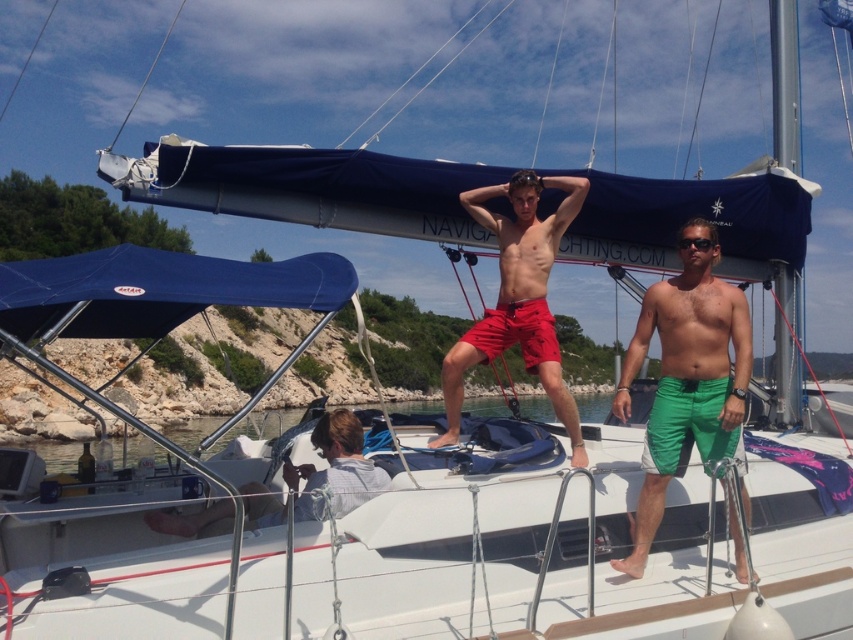
Is point (457, 401) positioned in front of point (200, 518)?

That is False.

Who is more forward, (556,212) or (354,493)?

Point (354,493)

At what (x,y) coordinates should I click in order to perform the action: click on matte red shorts at center. Please return your answer as a coordinate pair (x, y). The width and height of the screenshot is (853, 640). Looking at the image, I should click on (518, 298).

Who is taller, green fabric shorts at center or white cotton shirt at lower left?

green fabric shorts at center is taller.

The image size is (853, 640). Describe the element at coordinates (686, 378) in the screenshot. I see `green fabric shorts at center` at that location.

At what (x,y) coordinates should I click in order to perform the action: click on green fabric shorts at center. Please return your answer as a coordinate pair (x, y). This screenshot has width=853, height=640. Looking at the image, I should click on (686, 378).

Based on the photo, does matte red shorts at center have a lesser width compared to black plastic sunglasses at upper center?

Incorrect, matte red shorts at center's width is not less than black plastic sunglasses at upper center's.

Between point (549, 310) and point (694, 244), which one is positioned in front?

Point (694, 244) is more forward.

Find the location of `matte red shorts at center`. matte red shorts at center is located at coordinates (518, 298).